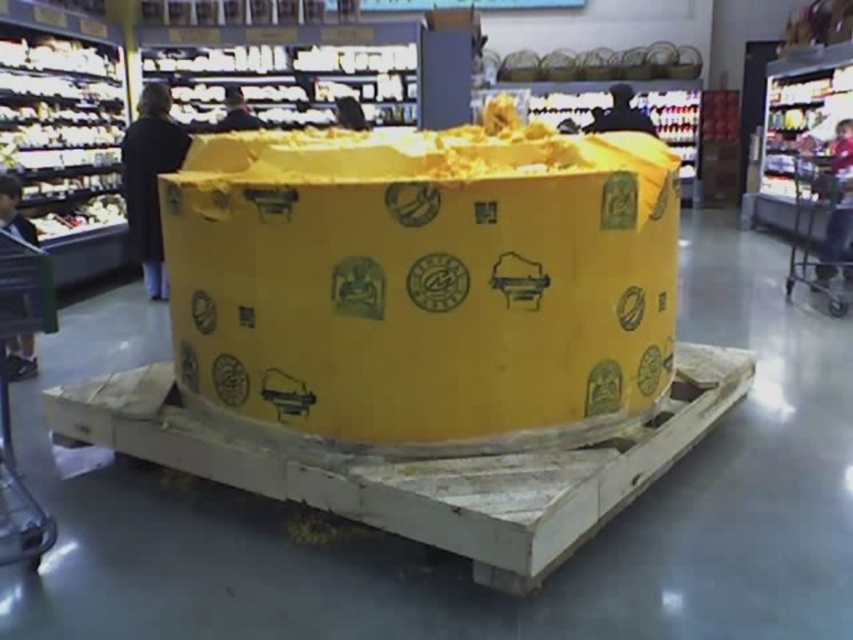
Is point (25, 548) positioned in front of point (834, 157)?

Yes.

Between point (10, 500) and point (834, 202), which one is positioned behind?

Positioned behind is point (834, 202).

At what (x,y) coordinates should I click in order to perform the action: click on metallic silver shopping cart at lower left. Please return your answer as a coordinate pair (x, y). Looking at the image, I should click on (7, 397).

Is point (212, 282) in front of point (827, 282)?

Yes.

Who is positioned more to the left, yellow cardboard box at center or metallic silver shopping cart at right?

From the viewer's perspective, yellow cardboard box at center appears more on the left side.

Is point (463, 195) positioned before point (827, 198)?

Yes.

Image resolution: width=853 pixels, height=640 pixels. I want to click on yellow cardboard box at center, so click(x=422, y=278).

Is yellow cardboard box at center above metallic silver shopping cart at lower left?

Yes, yellow cardboard box at center is above metallic silver shopping cart at lower left.

Identify the location of yellow cardboard box at center. This screenshot has width=853, height=640. (422, 278).